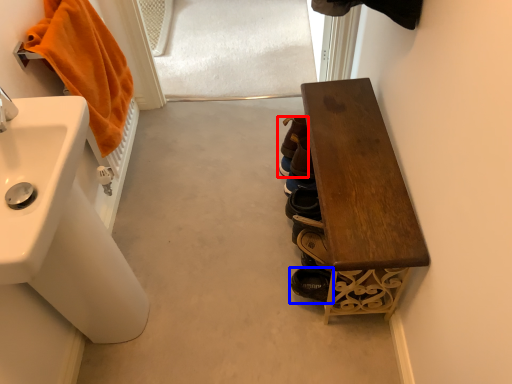
Question: Which point is closer to the camera, footwear (highlighted by a red box) or footwear (highlighted by a blue box)?

Choices:
 (A) footwear
 (B) footwear

Answer: (B)